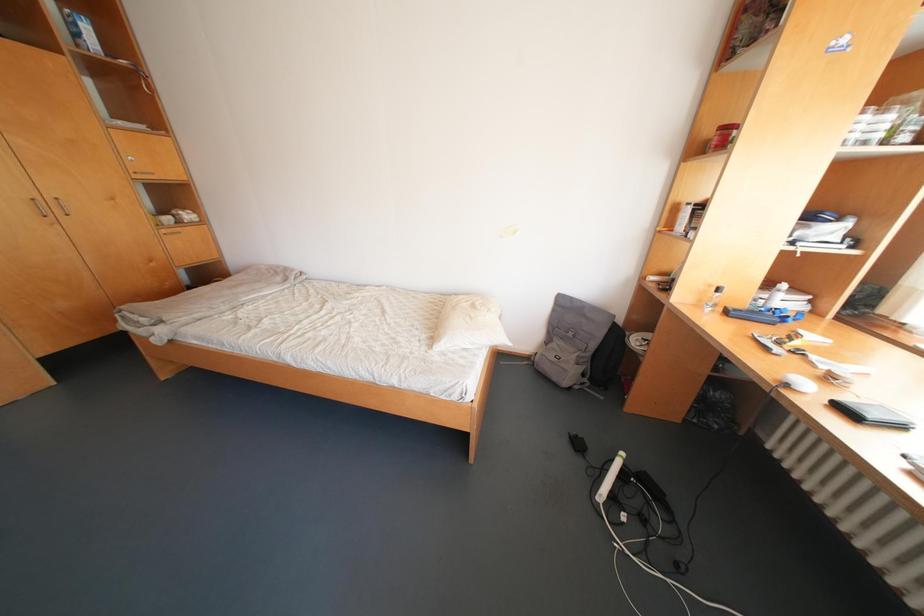
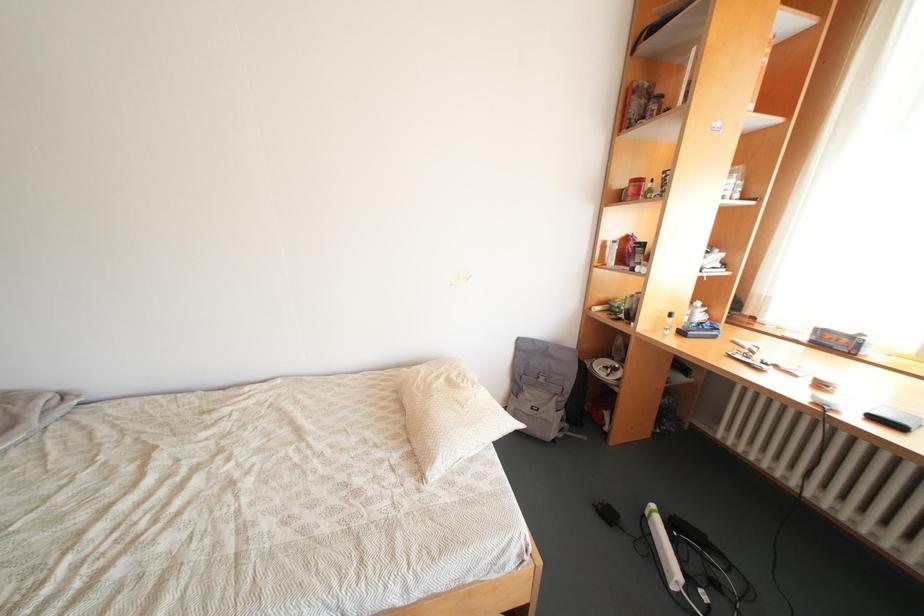
Question: The camera is either moving clockwise (left) or counter-clockwise (right) around the object. The first image is from the beginning of the video and the second image is from the end. Is the camera moving left or right when shooting the video?

Choices:
 (A) Left
 (B) Right

Answer: (A)